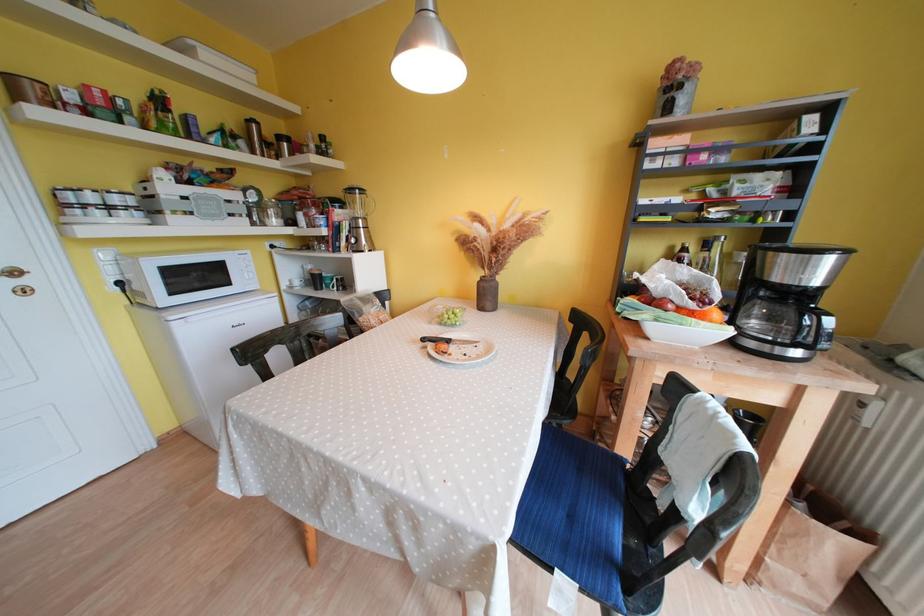
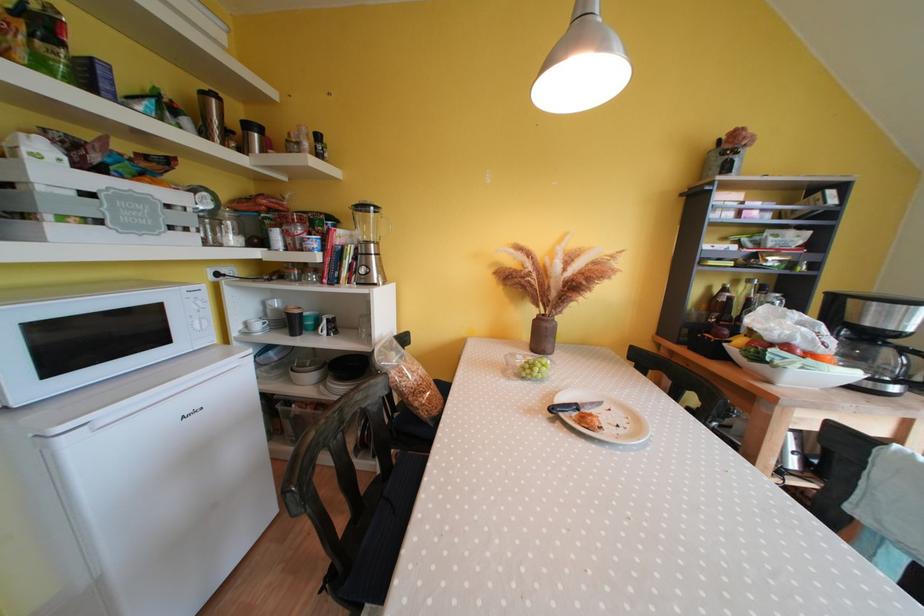
Where in the second image is the point corresponding to pixel 253 124 from the first image?

(209, 98)